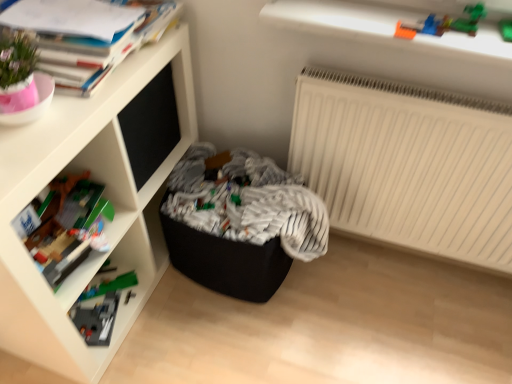
Question: Should I look upward or downward to see white matte radiator at upper right?

Choices:
 (A) up
 (B) down

Answer: (A)

Question: Should I look upward or downward to see matte paper book at upper left?

Choices:
 (A) down
 (B) up

Answer: (B)

Question: From a real-world perspective, does white matte shelf at upper left sit lower than matte paper book at upper left?

Choices:
 (A) no
 (B) yes

Answer: (B)

Question: Is white matte shelf at upper left directly adjacent to matte paper book at upper left?

Choices:
 (A) yes
 (B) no

Answer: (B)

Question: Would you say white matte shelf at upper left is outside matte paper book at upper left?

Choices:
 (A) no
 (B) yes

Answer: (B)

Question: Can you confirm if white matte shelf at upper left is bigger than matte paper book at upper left?

Choices:
 (A) yes
 (B) no

Answer: (A)

Question: Is white matte shelf at upper left behind matte paper book at upper left?

Choices:
 (A) yes
 (B) no

Answer: (B)

Question: Does white matte shelf at upper left have a greater width compared to matte paper book at upper left?

Choices:
 (A) no
 (B) yes

Answer: (B)

Question: Considering the relative positions of black fabric laundry at center and white matte radiator at upper right in the image provided, is black fabric laundry at center in front of white matte radiator at upper right?

Choices:
 (A) no
 (B) yes

Answer: (A)

Question: From a real-world perspective, is black fabric laundry at center on top of white matte radiator at upper right?

Choices:
 (A) yes
 (B) no

Answer: (B)

Question: Can we say black fabric laundry at center lies outside white matte radiator at upper right?

Choices:
 (A) no
 (B) yes

Answer: (B)

Question: Can you confirm if black fabric laundry at center is positioned to the left of white matte radiator at upper right?

Choices:
 (A) yes
 (B) no

Answer: (A)

Question: From a real-world perspective, is black fabric laundry at center positioned under white matte radiator at upper right based on gravity?

Choices:
 (A) yes
 (B) no

Answer: (A)

Question: Are black fabric laundry at center and white matte radiator at upper right beside each other?

Choices:
 (A) no
 (B) yes

Answer: (A)

Question: Is black fabric laundry at center not near matte paper book at upper left?

Choices:
 (A) no
 (B) yes

Answer: (A)